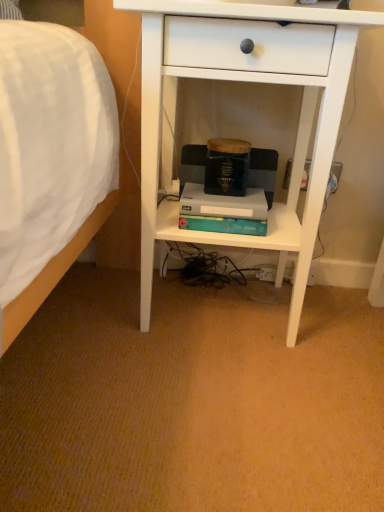
Describe the element at coordinates (247, 81) in the screenshot. This screenshot has width=384, height=512. I see `white matte desk at center` at that location.

Find the location of `white matte desk at center`. white matte desk at center is located at coordinates (247, 81).

What is the approximate width of teal matte paperback book at center?

The width of teal matte paperback book at center is 6.70 inches.

You are a GUI agent. You are given a task and a screenshot of the screen. Output one action in this format:
    pyautogui.click(x=<x>, y=<y>)
    Task: Click on the teal matte paperback book at center
    This screenshot has width=384, height=512.
    Given the screenshot: What is the action you would take?
    pyautogui.click(x=223, y=203)

The height and width of the screenshot is (512, 384). What do you see at coordinates (223, 203) in the screenshot? I see `teal matte paperback book at center` at bounding box center [223, 203].

This screenshot has height=512, width=384. I want to click on white matte desk at center, so click(x=247, y=81).

Based on the photo, between white matte desk at center and teal matte paperback book at center, which one appears on the left side from the viewer's perspective?

teal matte paperback book at center is more to the left.

In the image, is white matte desk at center positioned in front of or behind teal matte paperback book at center?

Visually, white matte desk at center is located in front of teal matte paperback book at center.

Is point (273, 18) more distant than point (212, 202)?

That is False.

From the image's perspective, is white matte desk at center under teal matte paperback book at center?

Incorrect, from the image's perspective, white matte desk at center is higher than teal matte paperback book at center.

From a real-world perspective, which is physically above, white matte desk at center or teal matte paperback book at center?

In real-world perspective, white matte desk at center is above.

Considering the sizes of objects white matte desk at center and teal matte paperback book at center in the image provided, who is thinner, white matte desk at center or teal matte paperback book at center?

teal matte paperback book at center.

Is white matte desk at center shorter than teal matte paperback book at center?

No.

Is white matte desk at center bigger than teal matte paperback book at center?

Yes.

Is white matte desk at center outside of teal matte paperback book at center?

white matte desk at center lies outside teal matte paperback book at center's area.

Are white matte desk at center and teal matte paperback book at center beside each other?

white matte desk at center is not next to teal matte paperback book at center, and they're not touching.

Is white matte desk at center facing towards teal matte paperback book at center?

Yes, white matte desk at center is facing teal matte paperback book at center.

Find the location of a particular element. paperback book that is on the left side of white matte desk at center is located at coordinates (223, 203).

Between teal matte paperback book at center and white matte desk at center, which one appears on the left side from the viewer's perspective?

Positioned to the left is teal matte paperback book at center.

Between teal matte paperback book at center and white matte desk at center, which one is positioned behind?

teal matte paperback book at center.

Is point (207, 205) farther from viewer compared to point (143, 242)?

Yes, it is.

From the image's perspective, is teal matte paperback book at center positioned above or below white matte desk at center?

teal matte paperback book at center is below white matte desk at center.

From a real-world perspective, is teal matte paperback book at center beneath white matte desk at center?

Yes.

Can you confirm if teal matte paperback book at center is thinner than white matte desk at center?

Correct, the width of teal matte paperback book at center is less than that of white matte desk at center.

Considering the relative sizes of teal matte paperback book at center and white matte desk at center in the image provided, is teal matte paperback book at center taller than white matte desk at center?

No.

Considering the relative sizes of teal matte paperback book at center and white matte desk at center in the image provided, is teal matte paperback book at center bigger than white matte desk at center?

No, teal matte paperback book at center is not bigger than white matte desk at center.

Is teal matte paperback book at center not within white matte desk at center?

That's incorrect, teal matte paperback book at center is not completely outside white matte desk at center.

Is teal matte paperback book at center not close to white matte desk at center?

teal matte paperback book at center is actually quite close to white matte desk at center.

Is teal matte paperback book at center looking in the opposite direction of white matte desk at center?

Yes, white matte desk at center is at the back of teal matte paperback book at center.

Locate an element on the screen. desk above the teal matte paperback book at center (from the image's perspective) is located at coordinates (247, 81).

You are a GUI agent. You are given a task and a screenshot of the screen. Output one action in this format:
    pyautogui.click(x=<x>, y=<y>)
    Task: Click on the paperback book lying on the left of white matte desk at center
    This screenshot has height=512, width=384.
    Given the screenshot: What is the action you would take?
    pyautogui.click(x=223, y=203)

Find the location of a particular element. The image size is (384, 512). desk above the teal matte paperback book at center (from the image's perspective) is located at coordinates (247, 81).